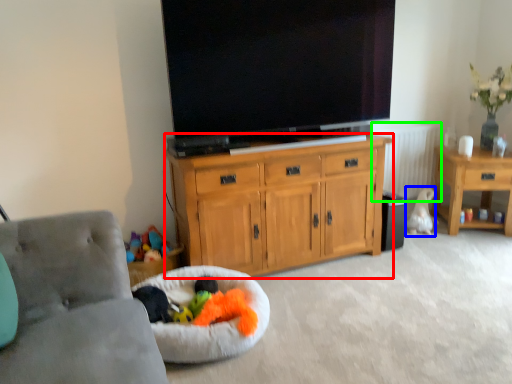
Question: Which is nearer to the cabinetry (highlighted by a red box)? animal (highlighted by a blue box) or radiator (highlighted by a green box).

Choices:
 (A) animal
 (B) radiator

Answer: (B)